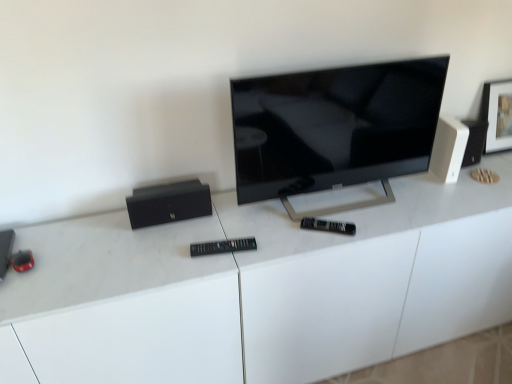
Locate an element on the screen. Image resolution: width=512 pixels, height=384 pixels. vacant region to the left of white plastic speaker at upper right, the 1th speaker when ordered from right to left is located at coordinates (405, 188).